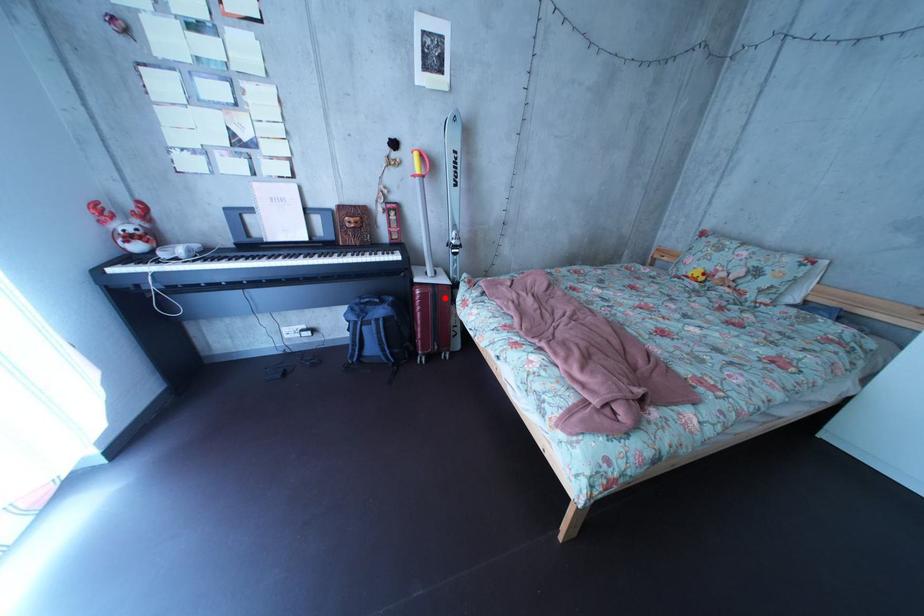
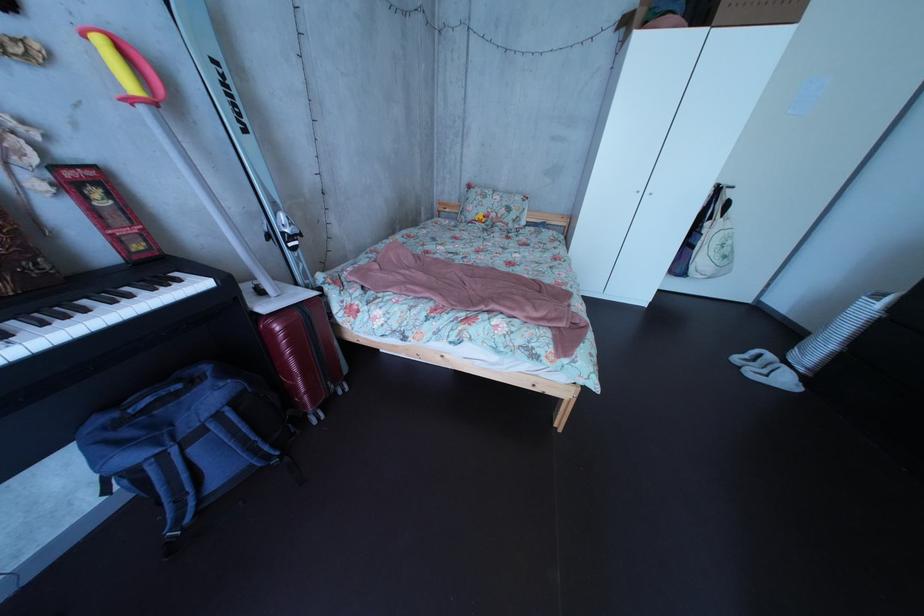
Question: I am providing you with two images of the same scene from different viewpoints. Image1 has a red point marked. In image2, the corresponding 3D location appears at what relative position? Reply with the corresponding letter.

Choices:
 (A) Closer
 (B) Farther

Answer: (A)